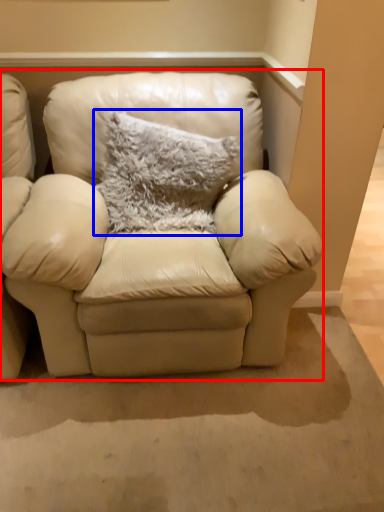
Question: Which object is further to the camera taking this photo, studio couch (highlighted by a red box) or pillow (highlighted by a blue box)?

Choices:
 (A) studio couch
 (B) pillow

Answer: (B)